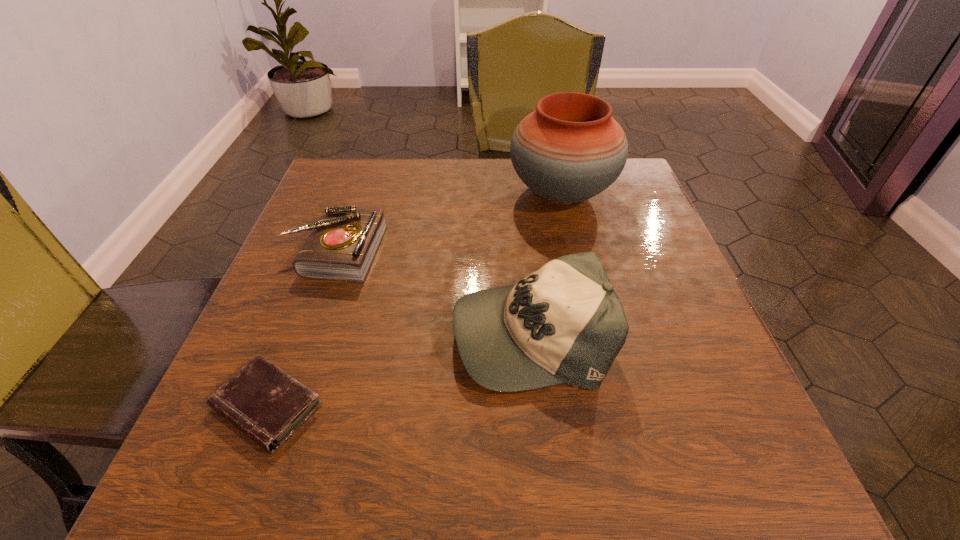
I want to click on pottery, so click(x=570, y=149).

This screenshot has width=960, height=540. I want to click on baseball cap, so click(564, 323).

Locate an element on the screen. This screenshot has height=540, width=960. the third tallest object is located at coordinates (343, 243).

Where is `the taller diary`? This screenshot has height=540, width=960. the taller diary is located at coordinates pos(343,243).

I want to click on the nearer diary, so click(x=261, y=400).

Find the location of `the shortest object`. the shortest object is located at coordinates (261, 400).

You are a GUI agent. You are given a task and a screenshot of the screen. Output one action in this format:
    pyautogui.click(x=<x>, y=<y>)
    Task: Click on the vacant area situated 0.100m on the front of the tallest object
    
    Given the screenshot: What is the action you would take?
    pyautogui.click(x=576, y=257)

The height and width of the screenshot is (540, 960). Identify the location of free space located 0.210m on the front-facing side of the baseball cap. (330, 332).

Where is `vacant space located 0.080m on the front-facing side of the baseball cap`? The image size is (960, 540). vacant space located 0.080m on the front-facing side of the baseball cap is located at coordinates coord(407,332).

The width and height of the screenshot is (960, 540). In order to click on free space located 0.240m on the front-facing side of the baseball cap in this screenshot , I will do `click(313, 332)`.